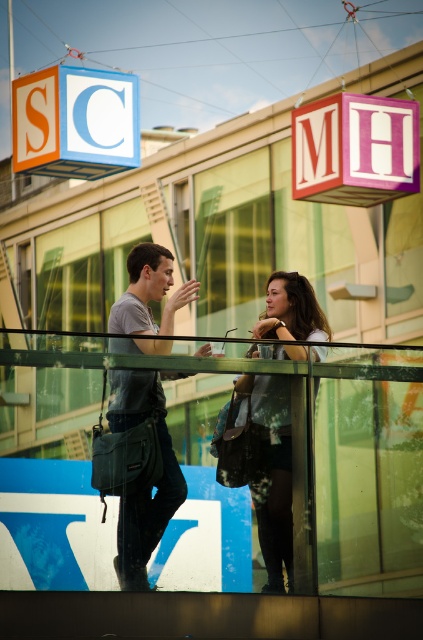
You are a delivery person trying to locate a pink wood sign at upper center. You see an orange matte cube at upper left in the scene. Which object is located more to the left?

The orange matte cube at upper left is positioned on the left side of the pink wood sign at upper center, so the orange matte cube at upper left is more to the left.

You are an architect designing a new public space and want to place a small sculpture and an information board on a glass platform. The orange matte cube at upper left and the pink wood sign at upper center are your options. Based on their sizes, which one would you choose to ensure it doesn t block the view from the platform?

The orange matte cube at upper left occupies less space than the pink wood sign at upper center, so choosing the orange matte cube at upper left would be better to ensure it doesn t block the view from the platform.